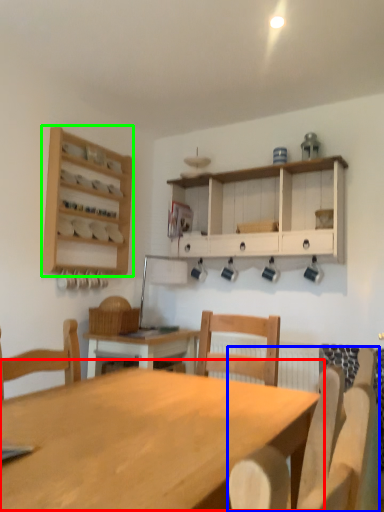
Question: Which is farther away from table (highlighted by a red box)? chair (highlighted by a blue box) or shelf (highlighted by a green box)?

Choices:
 (A) chair
 (B) shelf

Answer: (B)